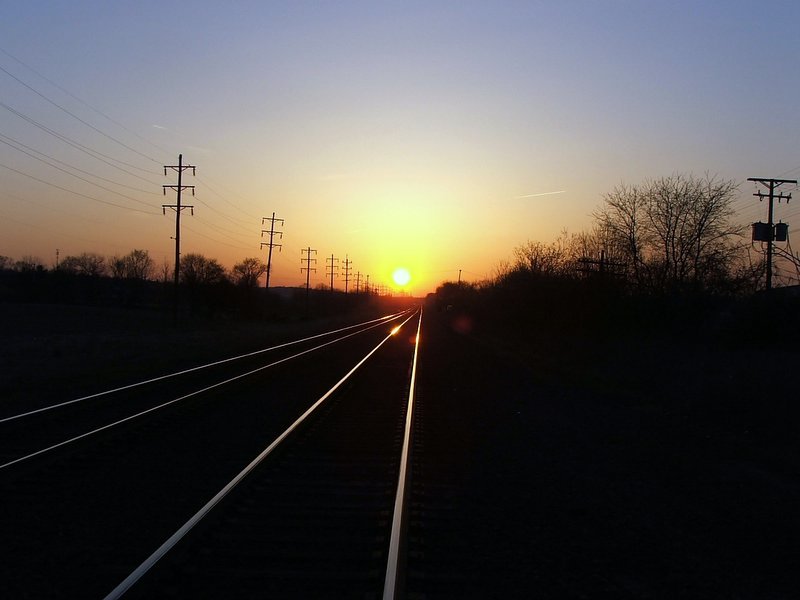
You are a GUI agent. You are given a task and a screenshot of the screen. Output one action in this format:
    pyautogui.click(x=<x>, y=<y>)
    Task: Click on the hook
    The image size is (800, 600).
    Given the screenshot: What is the action you would take?
    pyautogui.click(x=158, y=232)